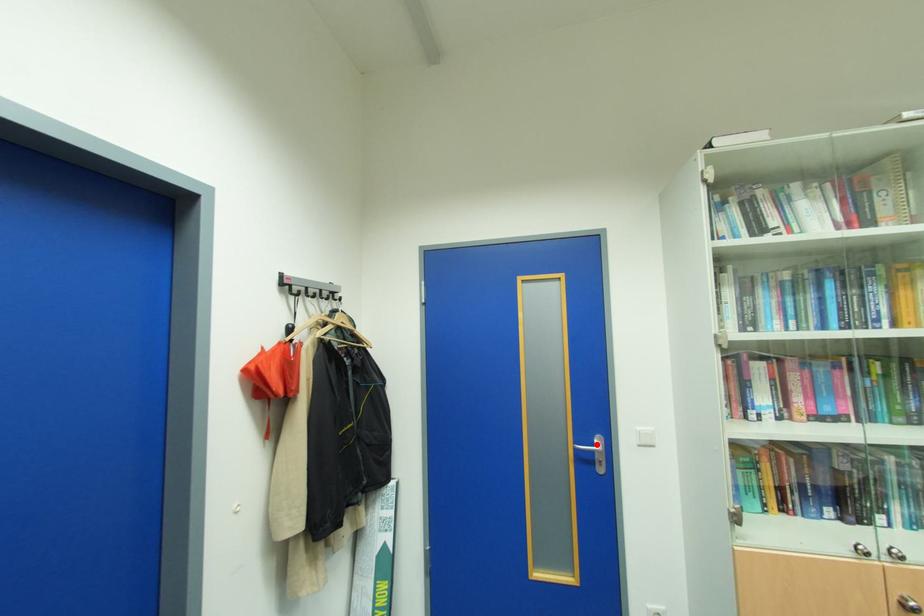
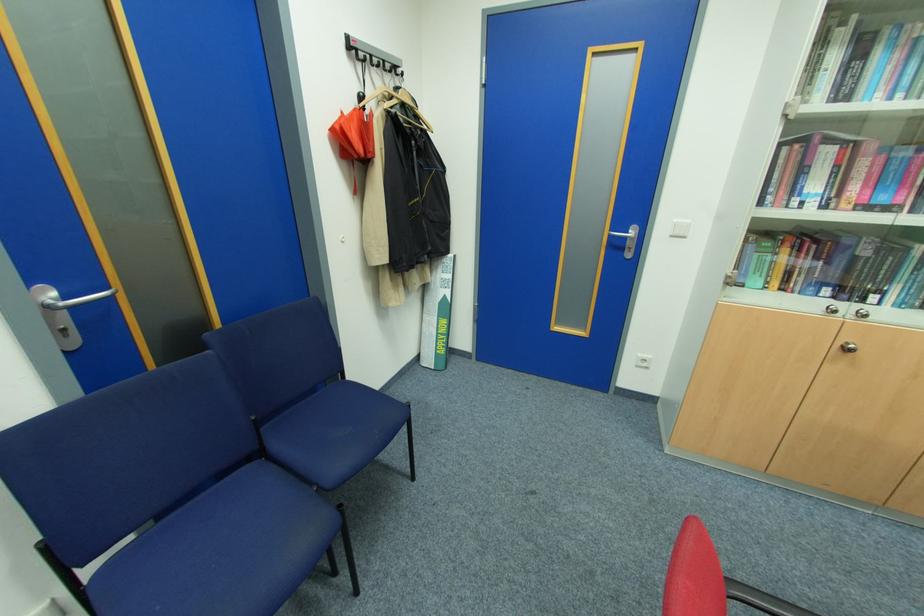
Where in the second image is the point corresponding to the highlighted location from the first image?

(630, 233)